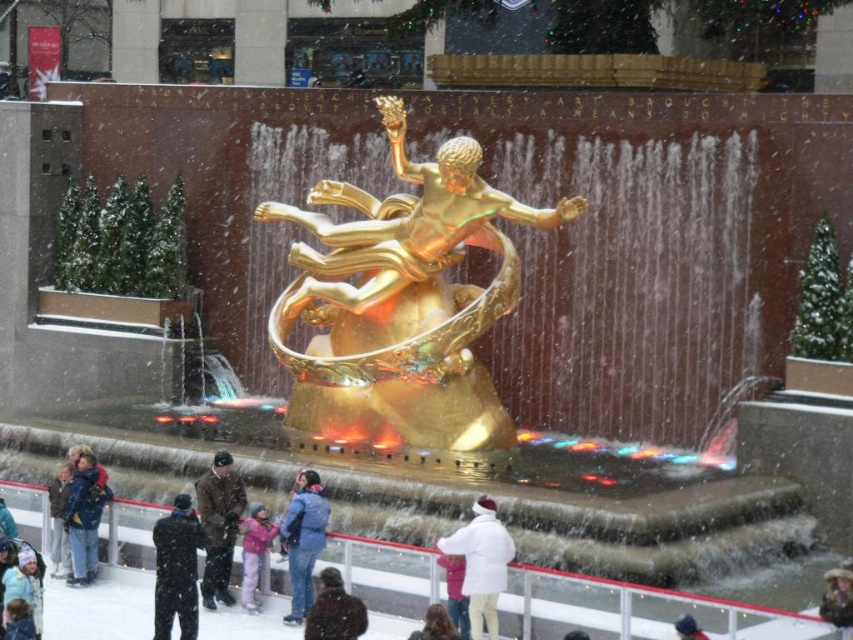
Describe the element at coordinates (838, 600) in the screenshot. This screenshot has height=640, width=853. I see `brown woolen hat at center` at that location.

Which is behind, point (821, 602) or point (461, 604)?

The point (821, 602) is behind.

Between point (839, 580) and point (461, 592), which one is positioned in front?

Point (839, 580)

Find the location of a particular element. This screenshot has width=853, height=640. brown woolen hat at center is located at coordinates (838, 600).

Who is lower down, dark blue jacket at lower left or matte pink coat at lower center?

matte pink coat at lower center is below.

Consider the image. Does dark blue jacket at lower left appear on the right side of matte pink coat at lower center?

Incorrect, dark blue jacket at lower left is not on the right side of matte pink coat at lower center.

Does point (77, 538) come closer to viewer compared to point (465, 608)?

No, it is behind (465, 608).

At what (x,y) coordinates should I click in order to perform the action: click on dark blue jacket at lower left. Please return your answer as a coordinate pair (x, y). Looking at the image, I should click on (84, 516).

Does brown fuzzy coat at center appear on the right side of brown leather jacket at lower left?

Correct, you'll find brown fuzzy coat at center to the right of brown leather jacket at lower left.

You are a GUI agent. You are given a task and a screenshot of the screen. Output one action in this format:
    pyautogui.click(x=<x>, y=<y>)
    Task: Click on the brown fuzzy coat at center
    The height and width of the screenshot is (640, 853).
    Given the screenshot: What is the action you would take?
    pyautogui.click(x=219, y=525)

Who is more forward, (239, 499) or (51, 577)?

Point (239, 499) is in front.

The image size is (853, 640). I want to click on brown fuzzy coat at center, so click(219, 525).